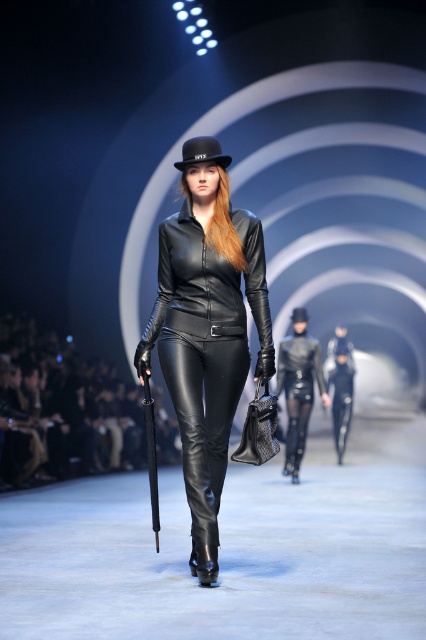
You are a fashion designer observing the runway show. You notice the matte black leather outfit at center and the black leather hat at center. Which item is located lower in the image?

The matte black leather outfit at center is positioned under the black leather hat at center, so it is located lower in the image.

You are a fashion designer observing the runway show. You need to determine which item is taller between the matte black leather outfit at center and the black leather hat at center. Which one is taller?

The matte black leather outfit at center is much taller than the black leather hat at center.